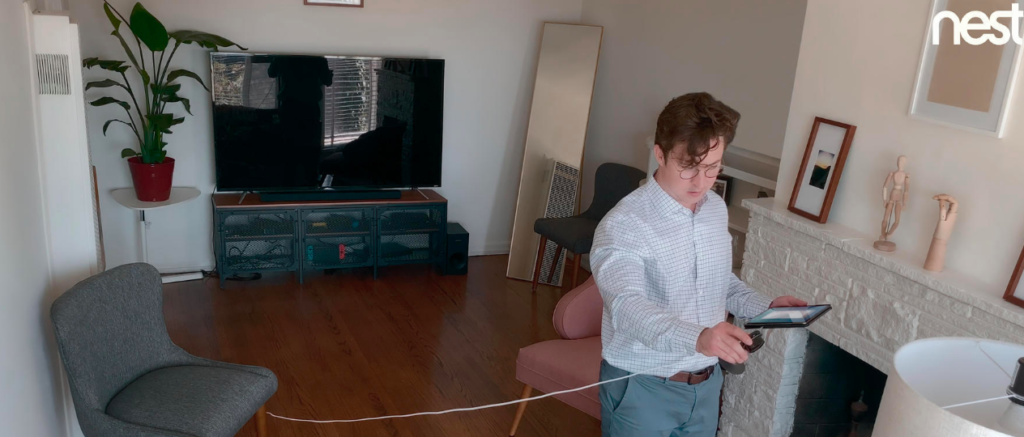
Where is `cord`? cord is located at coordinates (543, 392).